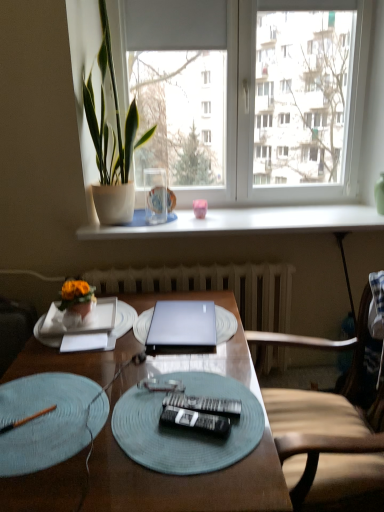
The image size is (384, 512). Find the location of `vacant location below light blue textured placemat at lower left (from a real-world perspective)`. vacant location below light blue textured placemat at lower left (from a real-world perspective) is located at coordinates (57, 420).